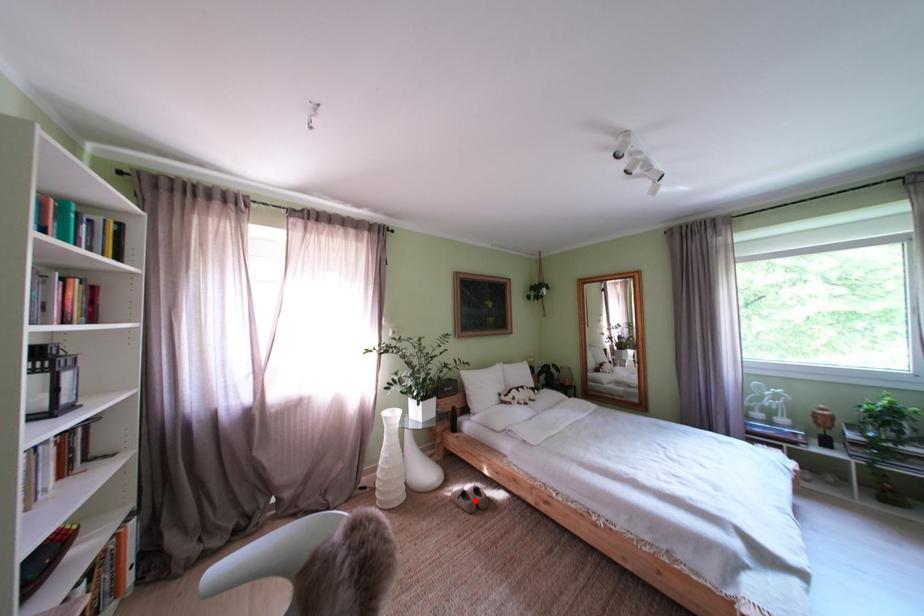
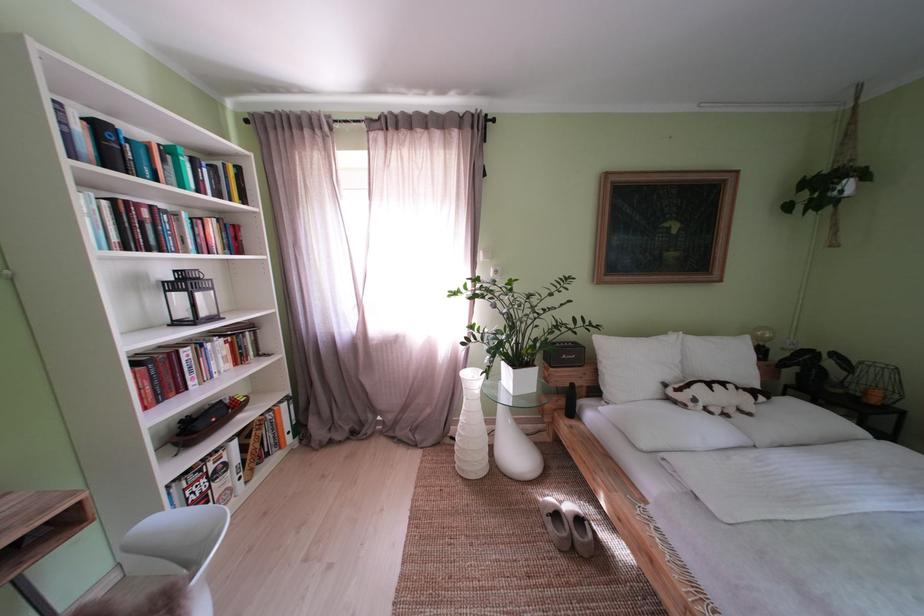
Find the pixel in the second image that matches the highlighted location in the first image.

(567, 521)